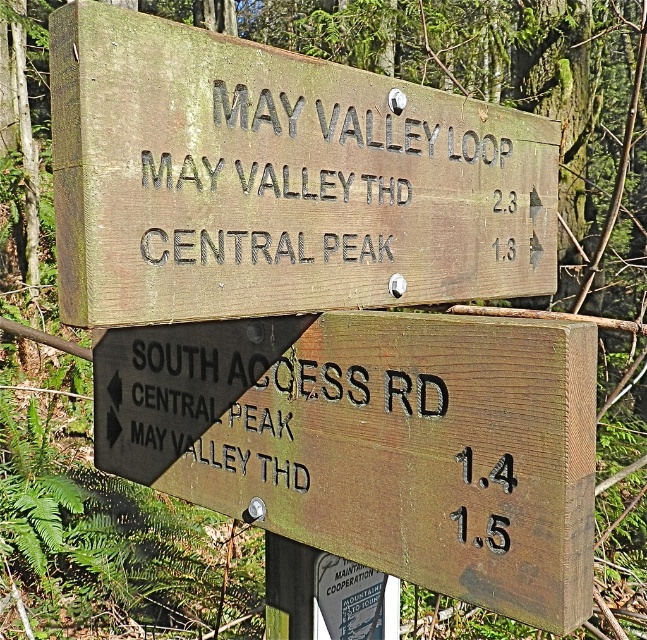
Question: Considering the relative positions of weathered wood sign at upper center and weathered wood sign at lower right in the image provided, where is weathered wood sign at upper center located with respect to weathered wood sign at lower right?

Choices:
 (A) right
 (B) left

Answer: (A)

Question: Can you confirm if weathered wood sign at upper center is smaller than weathered wood sign at lower right?

Choices:
 (A) yes
 (B) no

Answer: (A)

Question: Among these points, which one is farthest from the camera?

Choices:
 (A) (424, 120)
 (B) (402, 524)

Answer: (A)

Question: Does weathered wood sign at upper center appear over weathered wood sign at lower right?

Choices:
 (A) no
 (B) yes

Answer: (B)

Question: Which point is farther to the camera?

Choices:
 (A) weathered wood sign at lower right
 (B) weathered wood sign at upper center

Answer: (A)